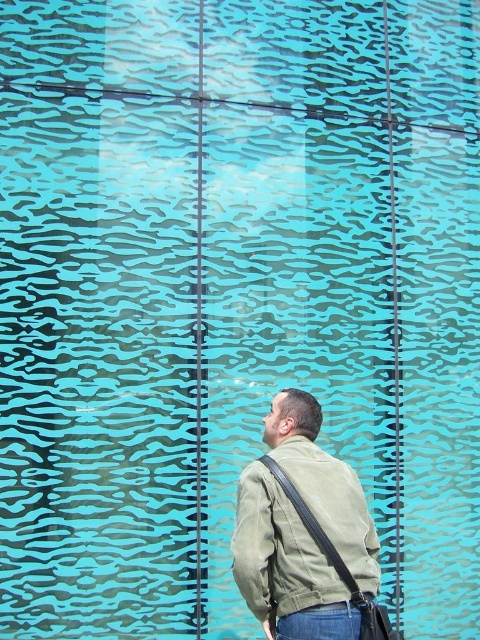
Question: Is khaki fabric jacket at center in front of denim at lower center?

Choices:
 (A) no
 (B) yes

Answer: (B)

Question: Can you confirm if khaki fabric jacket at center is smaller than denim at lower center?

Choices:
 (A) yes
 (B) no

Answer: (B)

Question: Which point appears farthest from the camera in this image?

Choices:
 (A) (295, 627)
 (B) (356, 515)

Answer: (B)

Question: Does khaki fabric jacket at center lie in front of denim at lower center?

Choices:
 (A) yes
 (B) no

Answer: (A)